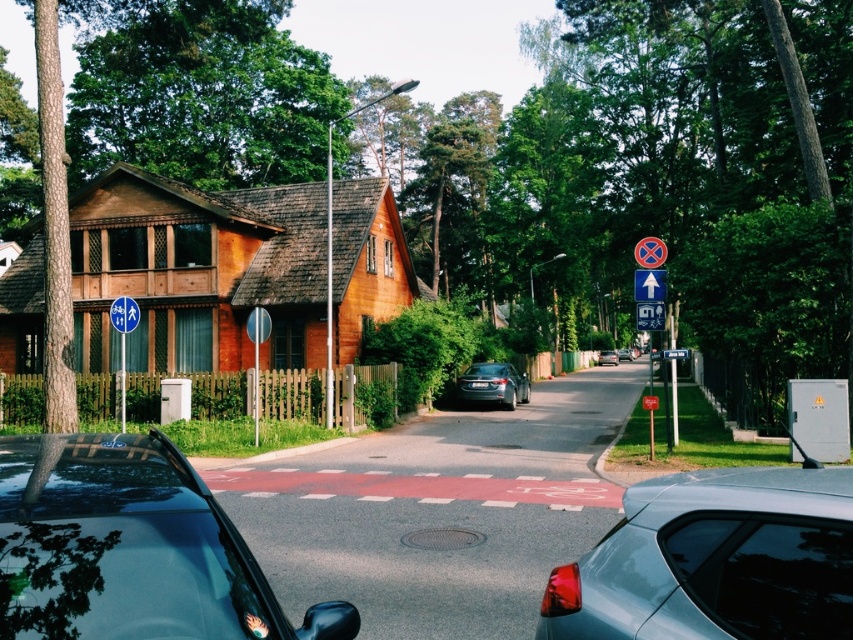
Who is lower down, matte gray car at lower right or matte gray car at center?

matte gray car at center

Can you confirm if matte gray car at lower right is positioned below matte gray car at center?

Actually, matte gray car at lower right is above matte gray car at center.

Is point (759, 627) in front of point (631, 356)?

That is True.

The height and width of the screenshot is (640, 853). I want to click on matte gray car at lower right, so click(715, 561).

Is green leafy tree at upper left bigger than satin black sedan at center?

Indeed, green leafy tree at upper left has a larger size compared to satin black sedan at center.

Is green leafy tree at upper left taller than satin black sedan at center?

Yes, green leafy tree at upper left is taller than satin black sedan at center.

Between point (189, 33) and point (488, 396), which one is positioned in front?

Point (488, 396)

The image size is (853, 640). I want to click on green leafy tree at upper left, so click(x=664, y=170).

Who is taller, metallic circular sign at center or shiny silver sedan at center?

shiny silver sedan at center

Measure the distance between point (x=660, y=248) and camera.

Point (x=660, y=248) and camera are 48.95 feet apart.

Who is more forward, (639,260) or (616,360)?

Point (639,260) is in front.

At what (x,y) coordinates should I click in order to perform the action: click on metallic circular sign at center. Please return your answer as a coordinate pair (x, y). The width and height of the screenshot is (853, 640). Looking at the image, I should click on (648, 252).